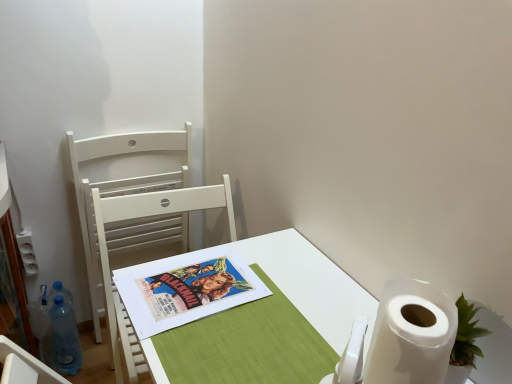
Find the location of a particular element. free spot in front of colorful paper poster at center is located at coordinates (210, 350).